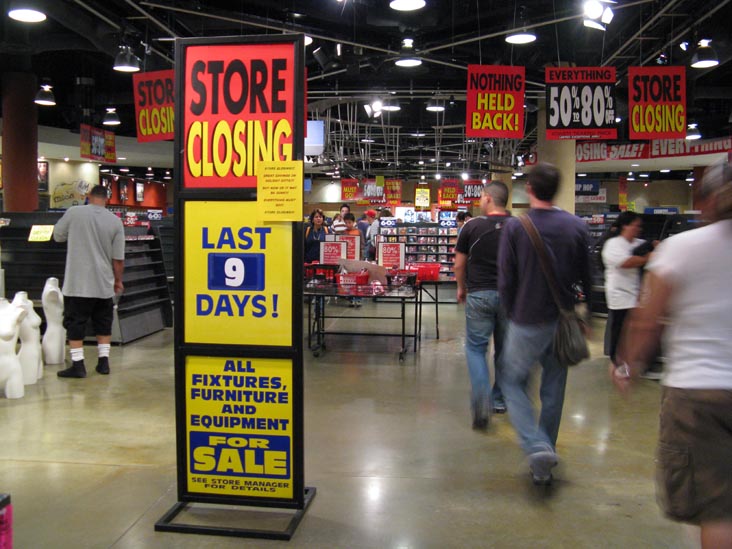
Image resolution: width=732 pixels, height=549 pixels. Find the location of `table`. table is located at coordinates (403, 295), (443, 277).